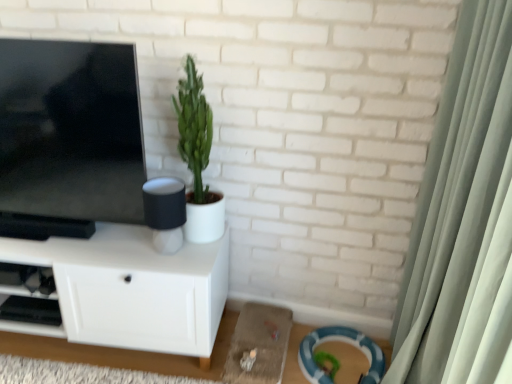
Question: Is green matte plant at center directly adjacent to black plastic shelf at lower left?

Choices:
 (A) yes
 (B) no

Answer: (B)

Question: Can you confirm if green matte plant at center is bigger than black plastic shelf at lower left?

Choices:
 (A) yes
 (B) no

Answer: (A)

Question: From the image's perspective, does green matte plant at center appear lower than black plastic shelf at lower left?

Choices:
 (A) no
 (B) yes

Answer: (A)

Question: Is green matte plant at center turned away from black plastic shelf at lower left?

Choices:
 (A) yes
 (B) no

Answer: (B)

Question: Can you confirm if green matte plant at center is smaller than black plastic shelf at lower left?

Choices:
 (A) no
 (B) yes

Answer: (A)

Question: Is green matte plant at center wider than black plastic shelf at lower left?

Choices:
 (A) no
 (B) yes

Answer: (A)

Question: Is white matte cabinet at left closer to the viewer compared to matte black speaker at center?

Choices:
 (A) yes
 (B) no

Answer: (A)

Question: Is white matte cabinet at left bigger than matte black speaker at center?

Choices:
 (A) no
 (B) yes

Answer: (B)

Question: From a real-world perspective, is white matte cabinet at left located higher than matte black speaker at center?

Choices:
 (A) no
 (B) yes

Answer: (A)

Question: Is white matte cabinet at left to the left of matte black speaker at center from the viewer's perspective?

Choices:
 (A) yes
 (B) no

Answer: (A)

Question: Is white matte cabinet at left completely or partially outside of matte black speaker at center?

Choices:
 (A) yes
 (B) no

Answer: (A)

Question: Is white matte cabinet at left aimed at matte black speaker at center?

Choices:
 (A) no
 (B) yes

Answer: (A)

Question: Is matte black tv at left turned away from black plastic shelf at lower left?

Choices:
 (A) no
 (B) yes

Answer: (A)